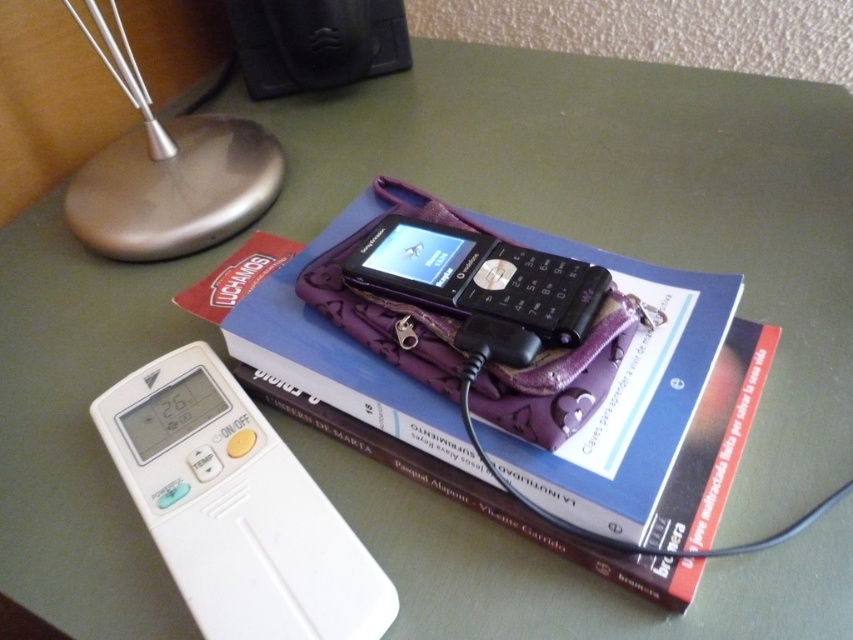
Is point (376, 593) in front of point (466, 257)?

Yes, it is in front of point (466, 257).

Can you confirm if white plastic ipod at lower left is taller than black plastic phone at center?

Correct, white plastic ipod at lower left is much taller as black plastic phone at center.

Where is `white plastic ipod at lower left`? white plastic ipod at lower left is located at coordinates (236, 508).

Is satin silver base at upper left to the right of black plastic phone at center from the viewer's perspective?

No, satin silver base at upper left is not to the right of black plastic phone at center.

In the scene shown: Which of these two, satin silver base at upper left or black plastic phone at center, stands shorter?

Standing shorter between the two is black plastic phone at center.

Find the location of `satin silver base at upper left`. satin silver base at upper left is located at coordinates (167, 172).

Can you confirm if blue hardcover book at center is positioned above satin silver base at upper left?

No.

Does point (648, 566) come behind point (273, 144)?

No, (648, 566) is in front of (273, 144).

Is point (451, 456) in front of point (123, 42)?

Yes, it is in front of point (123, 42).

The width and height of the screenshot is (853, 640). I want to click on blue hardcover book at center, so click(x=521, y=436).